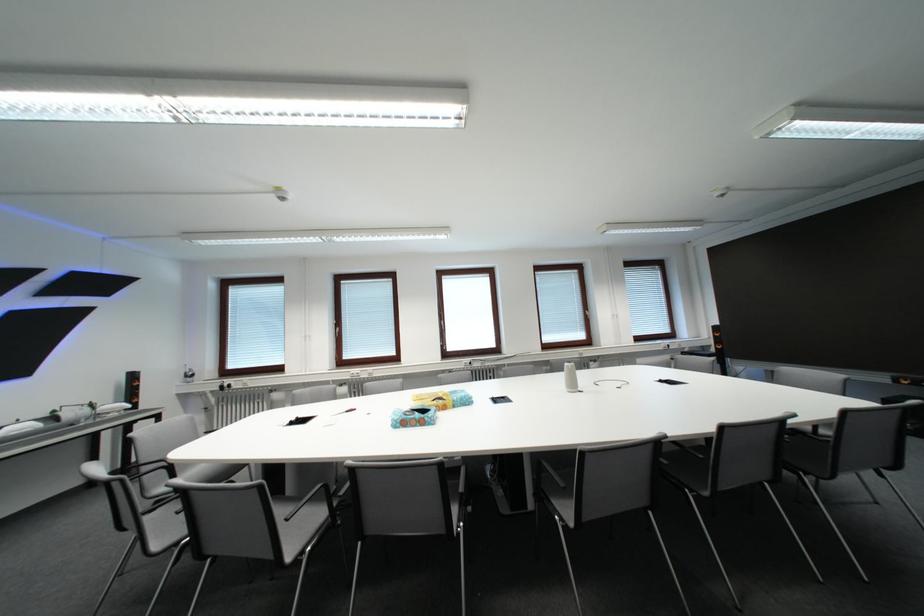
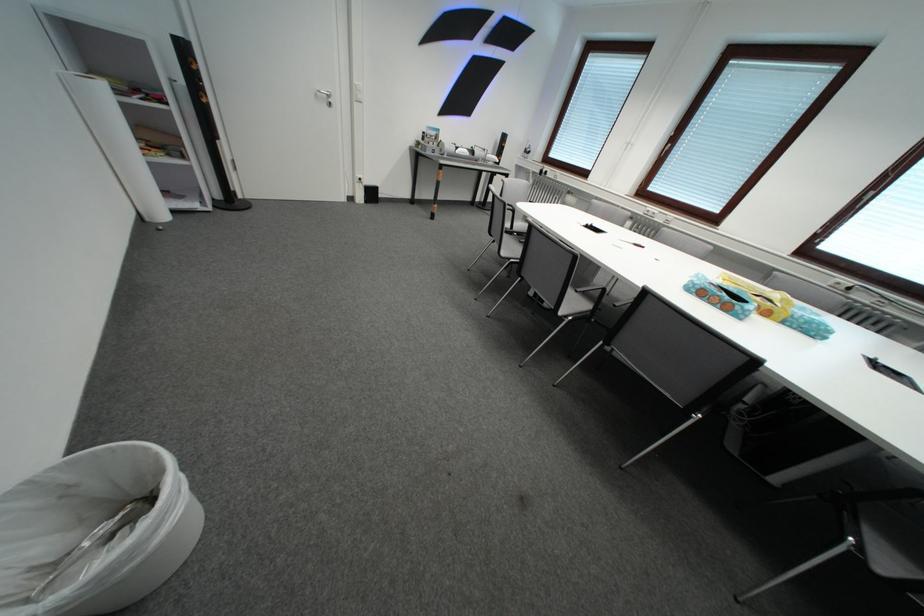
Locate, in the second image, the point that corresponds to pixel 166 549 in the first image.

(514, 256)